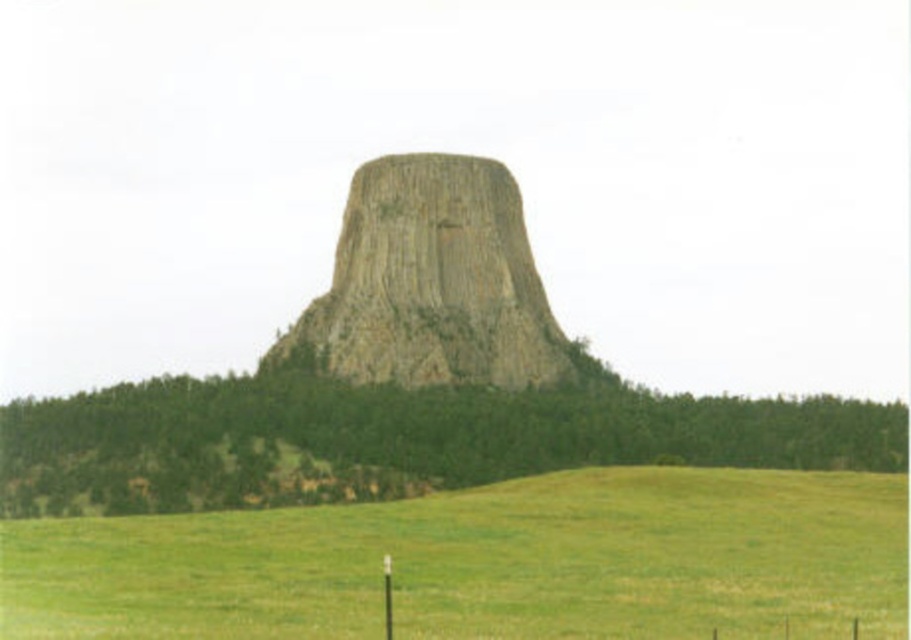
Which of these two, green grassy hill at center or rusty stone rock formation at center, stands taller?

rusty stone rock formation at center

Based on the photo, which of these two, green grassy hill at center or rusty stone rock formation at center, stands shorter?

Standing shorter between the two is green grassy hill at center.

Measure the distance between point (336, 484) and camera.

Point (336, 484) is 131.38 meters from camera.

Find the location of `green grassy hill at center`. green grassy hill at center is located at coordinates (394, 440).

Who is positioned more to the left, green grassy field at lower center or green grassy hill at center?

green grassy field at lower center

Is green grassy field at lower center thinner than green grassy hill at center?

Correct, green grassy field at lower center's width is less than green grassy hill at center's.

Where is `green grassy field at lower center`? The image size is (911, 640). green grassy field at lower center is located at coordinates (486, 563).

Where is `green grassy field at lower center`? green grassy field at lower center is located at coordinates (486, 563).

Who is positioned more to the right, green grassy field at lower center or rusty stone rock formation at center?

Positioned to the right is green grassy field at lower center.

Is green grassy field at lower center above rusty stone rock formation at center?

Actually, green grassy field at lower center is below rusty stone rock formation at center.

Describe the element at coordinates (486, 563) in the screenshot. I see `green grassy field at lower center` at that location.

At what (x,y) coordinates should I click in order to perform the action: click on green grassy field at lower center. Please return your answer as a coordinate pair (x, y). This screenshot has height=640, width=911. Looking at the image, I should click on (486, 563).